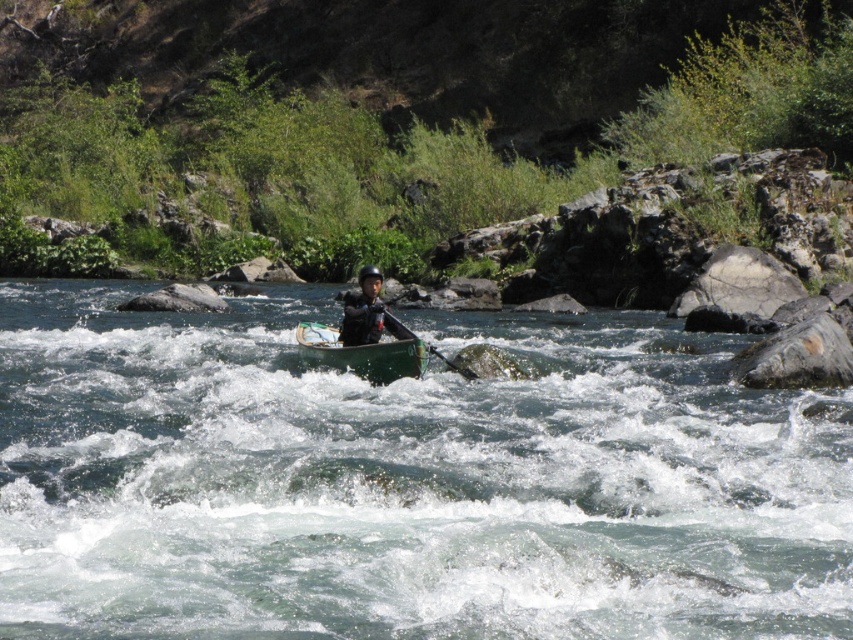
Question: Does green plastic canoe at center appear under green plastic paddle at center?

Choices:
 (A) no
 (B) yes

Answer: (A)

Question: Does green plastic canoe at center have a larger size compared to green plastic paddle at center?

Choices:
 (A) yes
 (B) no

Answer: (A)

Question: Which of the following is the farthest from the observer?

Choices:
 (A) green wood canoe at center
 (B) green plastic paddle at center

Answer: (B)

Question: Considering the real-world distances, which object is closest to the green plastic canoe at center?

Choices:
 (A) green wood canoe at center
 (B) green plastic paddle at center
 (C) matte black helmet at center

Answer: (B)

Question: Which point is closer to the camera taking this photo?

Choices:
 (A) (772, 458)
 (B) (376, 269)
 (C) (314, 348)
 (D) (474, 374)

Answer: (A)

Question: Does green wood canoe at center have a larger size compared to green plastic paddle at center?

Choices:
 (A) yes
 (B) no

Answer: (A)